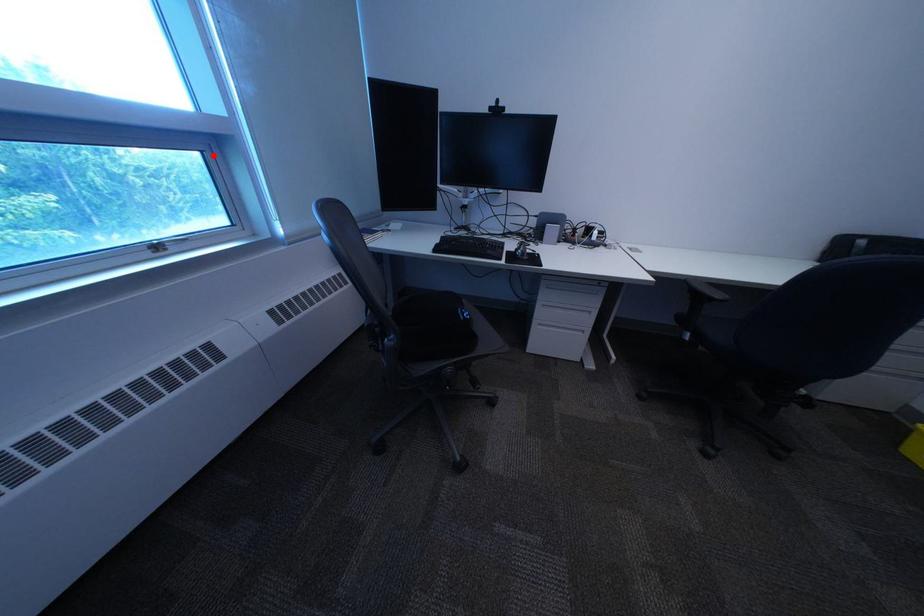
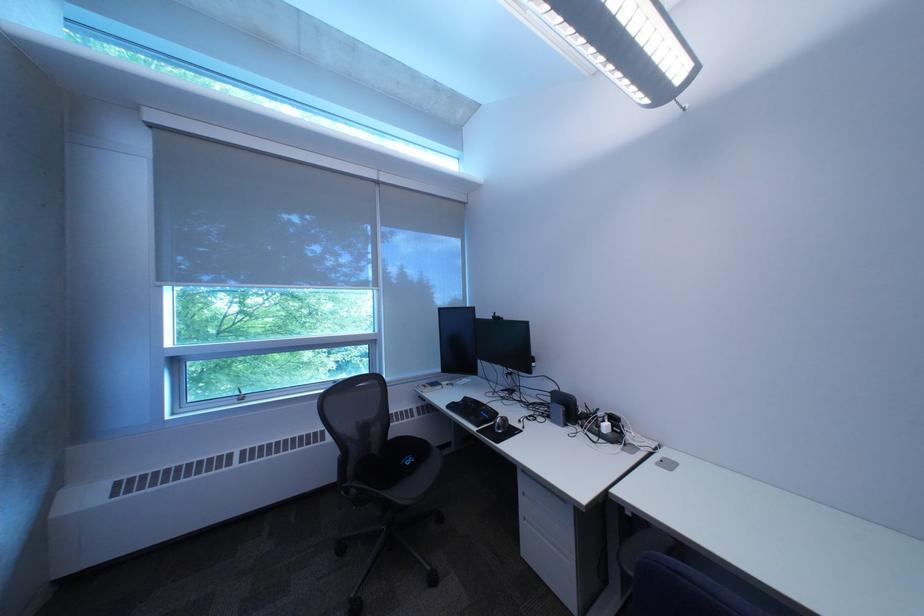
In the second image, find the point that corresponds to the highlighted location in the first image.

(383, 347)